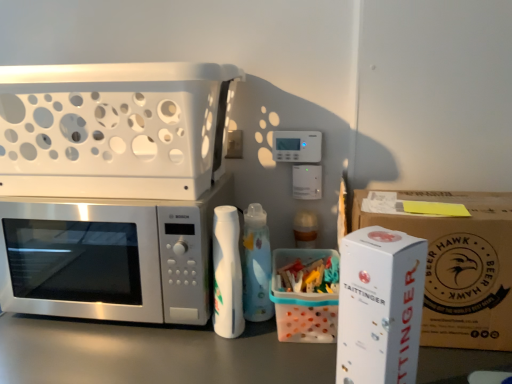
Find the location of a particular element. translucent plastic container at center, which ranks as the second cardboard box in right-to-left order is located at coordinates (303, 303).

Describe the element at coordinates (303, 303) in the screenshot. The image size is (512, 384). I see `translucent plastic container at center, the first cardboard box positioned from the left` at that location.

The width and height of the screenshot is (512, 384). What do you see at coordinates (459, 266) in the screenshot? I see `white cardboard box at right, the 1th cardboard box when ordered from right to left` at bounding box center [459, 266].

Identify the location of white plastic basket at upper left, the second appliance when ordered from right to left. (114, 129).

Is point (275, 306) more distant than point (355, 244)?

Yes.

Is translucent plastic container at center, which ranks as the second cardboard box in right-to-left order, aimed at white cardboard box at right, which appears as the 1th appliance when viewed from the right?

Yes.

Which object is positioned more to the right, translucent plastic container at center, which ranks as the second cardboard box in right-to-left order, or white cardboard box at right, which appears as the 1th appliance when viewed from the right?

white cardboard box at right, which appears as the 1th appliance when viewed from the right.

From a real-world perspective, between translucent plastic container at center, which ranks as the second cardboard box in right-to-left order, and white cardboard box at right, acting as the first appliance starting from the front, who is vertically higher?

From a 3D spatial view, white cardboard box at right, acting as the first appliance starting from the front, is above.

Considering the relative sizes of white plastic basket at upper left, the first appliance when ordered from top to bottom, and satin silver microwave at left in the image provided, is white plastic basket at upper left, the first appliance when ordered from top to bottom, taller than satin silver microwave at left?

In fact, white plastic basket at upper left, the first appliance when ordered from top to bottom, may be shorter than satin silver microwave at left.

Does point (77, 158) appear closer or farther from the camera than point (188, 296)?

Point (77, 158) is positioned closer to the camera compared to point (188, 296).

From a real-world perspective, is white plastic basket at upper left, the second appliance when ordered from bottom to top, below satin silver microwave at left?

No, from a real-world perspective, white plastic basket at upper left, the second appliance when ordered from bottom to top, is not below satin silver microwave at left.

Considering the relative positions of white plastic basket at upper left, marked as the first appliance in a left-to-right arrangement, and satin silver microwave at left in the image provided, is white plastic basket at upper left, marked as the first appliance in a left-to-right arrangement, behind satin silver microwave at left?

No, white plastic basket at upper left, marked as the first appliance in a left-to-right arrangement, is closer to the camera.

Could you tell me if satin silver microwave at left is turned towards white cardboard box at right, acting as the first appliance starting from the front?

No, satin silver microwave at left is not aimed at white cardboard box at right, acting as the first appliance starting from the front.

From a real-world perspective, is satin silver microwave at left positioned above or below white cardboard box at right, acting as the second appliance starting from the top?

satin silver microwave at left is situated lower than white cardboard box at right, acting as the second appliance starting from the top, in the real world.

Is satin silver microwave at left outside of white cardboard box at right, acting as the first appliance starting from the front?

Yes, satin silver microwave at left is located beyond the bounds of white cardboard box at right, acting as the first appliance starting from the front.

From the image's perspective, relative to white cardboard box at right, the 1th appliance ordered from the bottom, is satin silver microwave at left above or below?

Clearly, from the image's perspective, satin silver microwave at left is above white cardboard box at right, the 1th appliance ordered from the bottom.

Which appliance is the 1st one when counting from the front of the satin silver microwave at left? Please provide its 2D coordinates.

[(114, 129)]

Can you tell me how much satin silver microwave at left and white plastic basket at upper left, the second appliance when ordered from right to left, differ in facing direction?

1.7 degrees separate the facing orientations of satin silver microwave at left and white plastic basket at upper left, the second appliance when ordered from right to left.

Does satin silver microwave at left have a larger size compared to white plastic basket at upper left, the first appliance when ordered from top to bottom?

No, satin silver microwave at left is not bigger than white plastic basket at upper left, the first appliance when ordered from top to bottom.

Considering the sizes of objects white cardboard box at right, acting as the first appliance starting from the front, and translucent plastic container at center, the first cardboard box positioned from the left, in the image provided, who is wider, white cardboard box at right, acting as the first appliance starting from the front, or translucent plastic container at center, the first cardboard box positioned from the left,?

Wider between the two is translucent plastic container at center, the first cardboard box positioned from the left.

Is point (337, 368) in front of point (277, 297)?

Yes, it is.

In terms of height, does white cardboard box at right, which is counted as the second appliance, starting from the left, look taller or shorter compared to translucent plastic container at center, the first cardboard box positioned from the left?

Considering their sizes, white cardboard box at right, which is counted as the second appliance, starting from the left, has more height than translucent plastic container at center, the first cardboard box positioned from the left.

Can you tell me how much translucent plastic container at center, the first cardboard box positioned from the left, and white plastic basket at upper left, the second appliance when ordered from right to left, differ in facing direction?

2.97 degrees separate the facing orientations of translucent plastic container at center, the first cardboard box positioned from the left, and white plastic basket at upper left, the second appliance when ordered from right to left.

Measure the distance from translucent plastic container at center, the first cardboard box positioned from the left, to white plastic basket at upper left, the second appliance when ordered from bottom to top.

translucent plastic container at center, the first cardboard box positioned from the left, is 18.74 inches from white plastic basket at upper left, the second appliance when ordered from bottom to top.

Which object is further away from the camera taking this photo, translucent plastic container at center, the first cardboard box positioned from the left, or white plastic basket at upper left, the first appliance when ordered from top to bottom?

translucent plastic container at center, the first cardboard box positioned from the left.

Does translucent plastic container at center, the first cardboard box positioned from the left, have a larger size compared to white plastic basket at upper left, marked as the first appliance in a left-to-right arrangement?

Actually, translucent plastic container at center, the first cardboard box positioned from the left, might be smaller than white plastic basket at upper left, marked as the first appliance in a left-to-right arrangement.

Can you confirm if white cardboard box at right, the 2th appliance positioned from the back, is shorter than satin silver microwave at left?

Incorrect, the height of white cardboard box at right, the 2th appliance positioned from the back, does not fall short of that of satin silver microwave at left.

Which of these two, white cardboard box at right, which appears as the 1th appliance when viewed from the right, or satin silver microwave at left, is thinner?

white cardboard box at right, which appears as the 1th appliance when viewed from the right.

Does white cardboard box at right, which is counted as the second appliance, starting from the left, turn towards satin silver microwave at left?

No, white cardboard box at right, which is counted as the second appliance, starting from the left, is not aimed at satin silver microwave at left.

Is point (421, 286) closer or farther from the camera than point (28, 240)?

Point (421, 286) appears to be closer to the viewer than point (28, 240).

Identify the location of the 2nd appliance in front of the translucent plastic container at center, which ranks as the second cardboard box in right-to-left order. (380, 306).

This screenshot has height=384, width=512. Find the location of `microwave oven below the white plastic basket at upper left, which is the first appliance in back-to-front order (from a real-world perspective)`. microwave oven below the white plastic basket at upper left, which is the first appliance in back-to-front order (from a real-world perspective) is located at coordinates (110, 257).

Looking at the image, which one is located closer to satin silver microwave at left, translucent plastic container at center, the first cardboard box positioned from the left, or white plastic basket at upper left, which is the first appliance in back-to-front order?

Among the two, white plastic basket at upper left, which is the first appliance in back-to-front order, is located nearer to satin silver microwave at left.

Based on their spatial positions, is white cardboard box at right, the 1th appliance ordered from the bottom, or white cardboard box at right, acting as the second cardboard box starting from the left, closer to satin silver microwave at left?

white cardboard box at right, the 1th appliance ordered from the bottom, lies closer to satin silver microwave at left than the other object.

From the image, which object appears to be farther from translucent plastic container at center, the first cardboard box positioned from the left, white cardboard box at right, acting as the second appliance starting from the top, or satin silver microwave at left?

satin silver microwave at left lies further to translucent plastic container at center, the first cardboard box positioned from the left, than the other object.

Estimate the real-world distances between objects in this image. Which object is closer to satin silver microwave at left, white cardboard box at right, acting as the second cardboard box starting from the left, or translucent plastic container at center, the first cardboard box positioned from the left?

translucent plastic container at center, the first cardboard box positioned from the left, lies closer to satin silver microwave at left than the other object.

Estimate the real-world distances between objects in this image. Which object is further from white cardboard box at right, which appears as the 1th appliance when viewed from the right, satin silver microwave at left or white cardboard box at right, the 1th cardboard box when ordered from right to left?

satin silver microwave at left.

Based on their spatial positions, is satin silver microwave at left or white cardboard box at right, which appears as the 1th appliance when viewed from the right, closer to translucent plastic container at center, the first cardboard box positioned from the left?

Based on the image, white cardboard box at right, which appears as the 1th appliance when viewed from the right, appears to be nearer to translucent plastic container at center, the first cardboard box positioned from the left.

From the picture: Which object lies nearer to the anchor point white cardboard box at right, the 1th appliance ordered from the bottom, white cardboard box at right, acting as the second cardboard box starting from the left, or translucent plastic container at center, the first cardboard box positioned from the left?

white cardboard box at right, acting as the second cardboard box starting from the left.

Estimate the real-world distances between objects in this image. Which object is further from satin silver microwave at left, white cardboard box at right, the 1th cardboard box when ordered from right to left, or white cardboard box at right, the 2th appliance positioned from the back?

Based on the image, white cardboard box at right, the 1th cardboard box when ordered from right to left, appears to be further to satin silver microwave at left.

This screenshot has width=512, height=384. What are the coordinates of `microwave oven between white plastic basket at upper left, the second appliance when ordered from bottom to top, and translucent plastic container at center, which ranks as the second cardboard box in right-to-left order` in the screenshot? It's located at (110, 257).

This screenshot has height=384, width=512. Identify the location of appliance between satin silver microwave at left and white cardboard box at right, acting as the second cardboard box starting from the left, from left to right. (380, 306).

Where is `appliance between white plastic basket at upper left, which appears as the 2th appliance when viewed from the front, and white cardboard box at right, the 1th cardboard box when ordered from right to left, from left to right`? This screenshot has height=384, width=512. appliance between white plastic basket at upper left, which appears as the 2th appliance when viewed from the front, and white cardboard box at right, the 1th cardboard box when ordered from right to left, from left to right is located at coordinates (380, 306).

Find the location of a particular element. cardboard box between satin silver microwave at left and white cardboard box at right, the 1th cardboard box when ordered from right to left, in the horizontal direction is located at coordinates (303, 303).